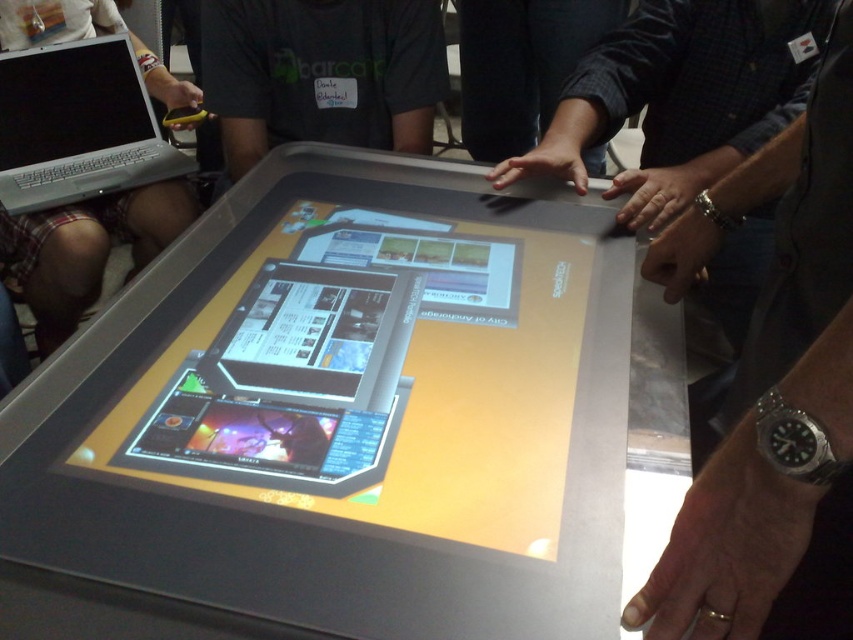
You are a security guard observing the scene. You notice the metallic silver watch at lower right and the silver metallic laptop at upper left. Which object is closer to you?

The metallic silver watch at lower right is closer to you because it is in front of the silver metallic laptop at upper left.

You are standing in front of the interactive touchscreen display and want to reach the point at coordinates point (x=44, y=480). If your arm can extend 24 inches, can you comfortably reach that point without moving your body?

The point (x=44, y=480) is 26.25 inches away from the viewer, which is beyond the 24 inches arm extension. Therefore, you cannot comfortably reach it without moving your body.

You are standing in front of the interactive touchscreen display and see two points on it. The first point is at coordinate (x=309, y=401) and the second point is at coordinate (x=276, y=38). Which point is closer to you?

Point (x=309, y=401) is closer to the viewer than point (x=276, y=38).